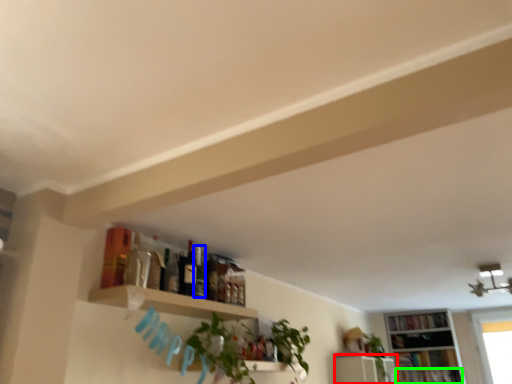
Question: Considering the real-world distances, which object is closest to shelf (highlighted by a red box)? bottle (highlighted by a blue box) or book (highlighted by a green box).

Choices:
 (A) bottle
 (B) book

Answer: (B)